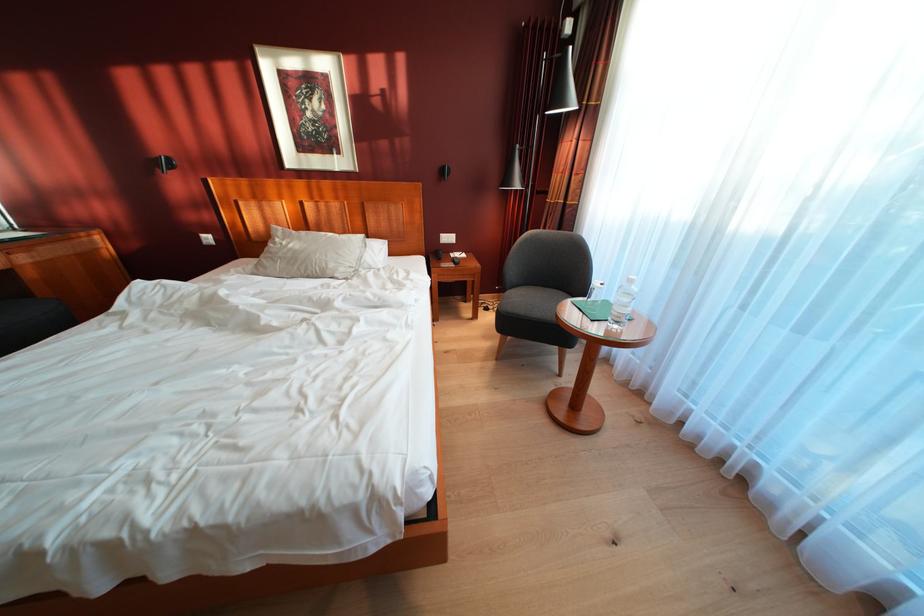
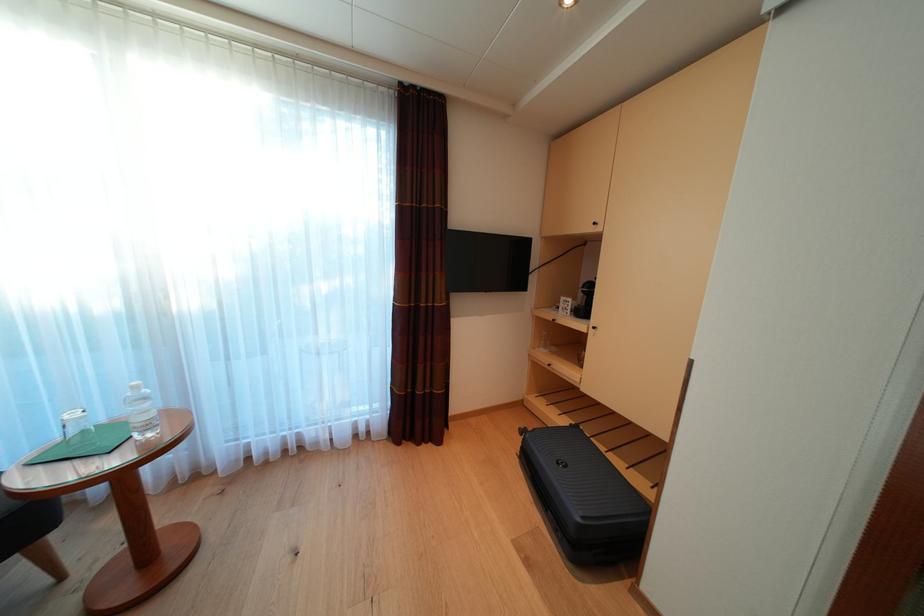
Where in the second image is the point corresponding to [638,286] from the first image?

(144, 392)